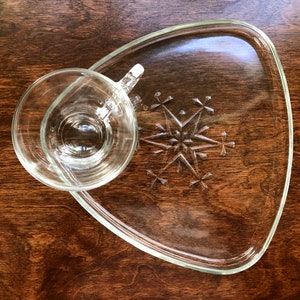
You are a GUI agent. You are given a task and a screenshot of the screen. Output one action in this format:
    pyautogui.click(x=<x>, y=<y>)
    Task: Click on the mug
    The width and height of the screenshot is (300, 300).
    Given the screenshot: What is the action you would take?
    pyautogui.click(x=110, y=96)